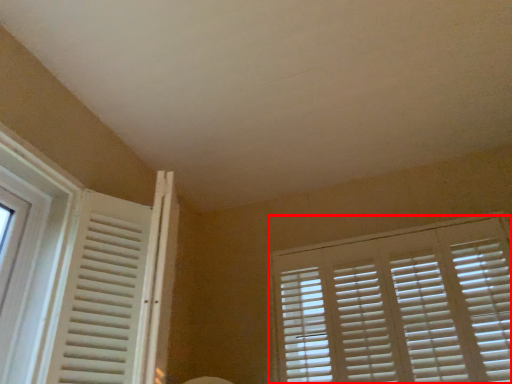
Question: From the image's perspective, where is window blind (annotated by the red box) located relative to window?

Choices:
 (A) below
 (B) above

Answer: (A)